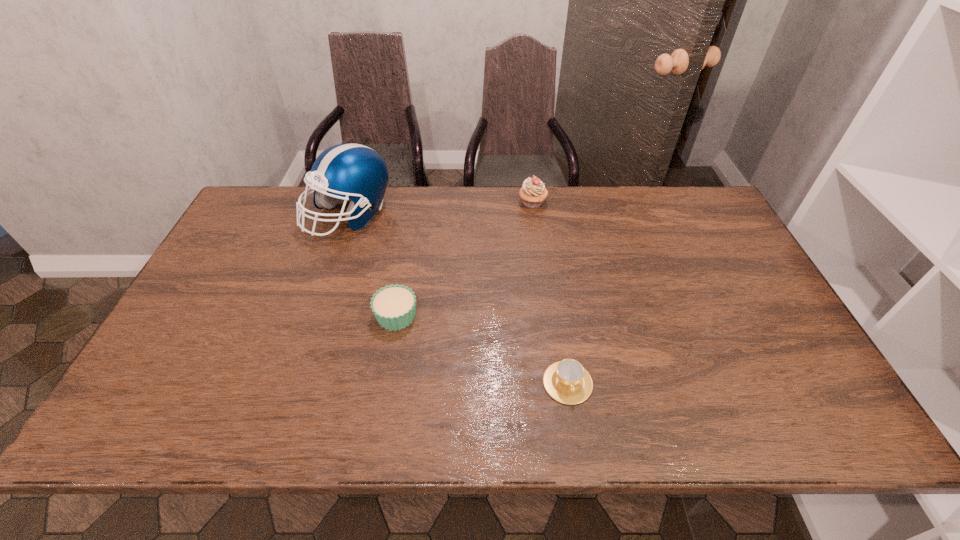
Where is `object that can be found as the closest to the football helmet`? The width and height of the screenshot is (960, 540). object that can be found as the closest to the football helmet is located at coordinates 394,307.

The image size is (960, 540). I want to click on free location that satisfies the following two spatial constraints: 1. at the front of the leftmost object with the faceguard; 2. on the left side of the second shortest object, so click(x=315, y=315).